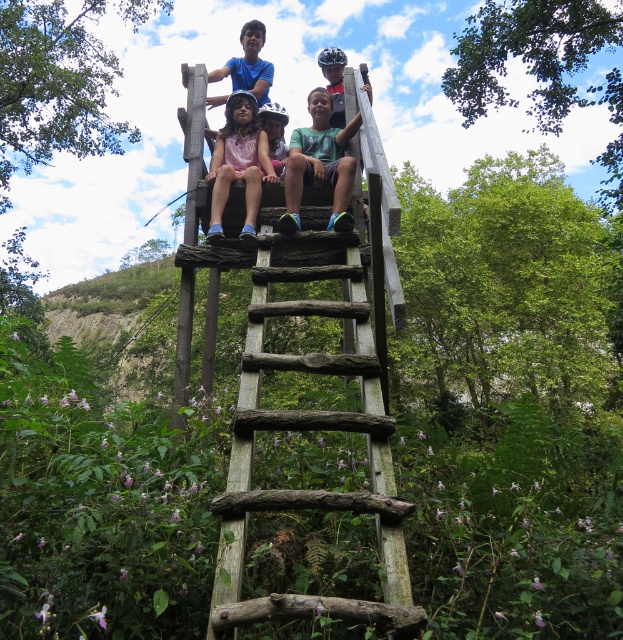
Question: Is weathered wood ladder at center wider than pink fabric dress at center?

Choices:
 (A) no
 (B) yes

Answer: (B)

Question: Estimate the real-world distances between objects in this image. Which object is closer to the weathered wood ladder at center?

Choices:
 (A) pink fabric dress at center
 (B) green matte shirt at center

Answer: (A)

Question: Does weathered wood ladder at center appear on the right side of green matte shirt at center?

Choices:
 (A) yes
 (B) no

Answer: (B)

Question: Among these objects, which one is nearest to the camera?

Choices:
 (A) pink fabric dress at center
 (B) weathered wood ladder at center

Answer: (B)

Question: Which point is closer to the camera?

Choices:
 (A) weathered wood ladder at center
 (B) pink fabric dress at center
 (C) green matte shirt at center

Answer: (A)

Question: Is green matte shirt at center smaller than pink fabric dress at center?

Choices:
 (A) yes
 (B) no

Answer: (B)